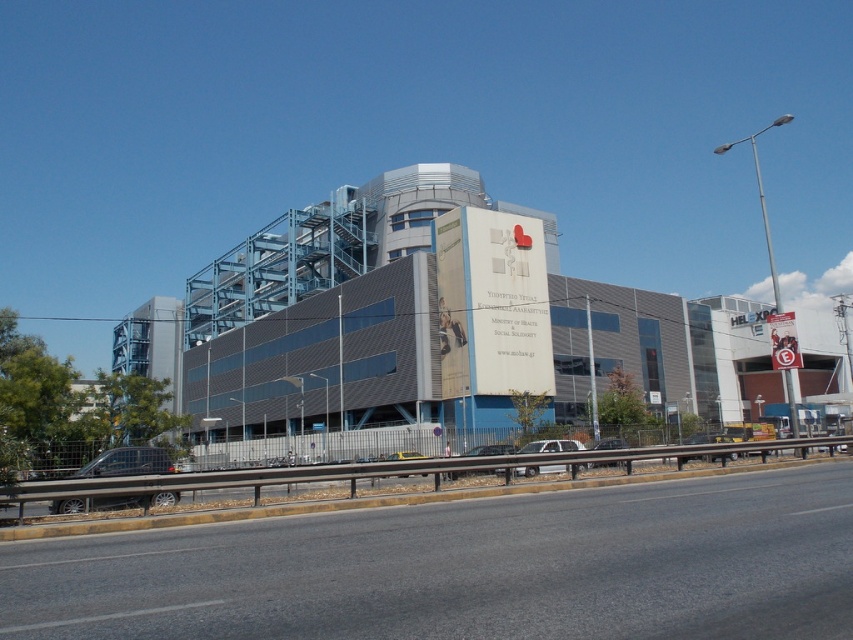
You are driving a delivery van and need to park behind the white matte sedan at center and the silver metallic sedan at center. Can you park your van behind both vehicles without overlapping them?

The white matte sedan at center is in front of the silver metallic sedan at center, so you can park behind both vehicles by positioning your van behind the silver metallic sedan at center, which is already behind the white matte sedan at center.

You are a delivery driver approaching the large building with the blue metallic framework. You need to park your white matte sedan at center in a spot that is exactly 20 meters away from the building. Based on the scene, can you safely park your car in the designated spot?

The distance between the white matte sedan at center and the camera is 17.92 meters, so the car is already closer than the required 20 meters. Therefore, you cannot park it in the designated spot as it is already within 17.92 meters of the camera position, which may not align with the 20 meters requirement from the building.

You are a pedestrian standing in front of the large building and want to take a taxi to the hospital. You see a metallic silver car at center and a yellow metallic taxi at center. Which vehicle should you approach first?

You should approach the metallic silver car at center first because it is closer to you than the yellow metallic taxi at center.